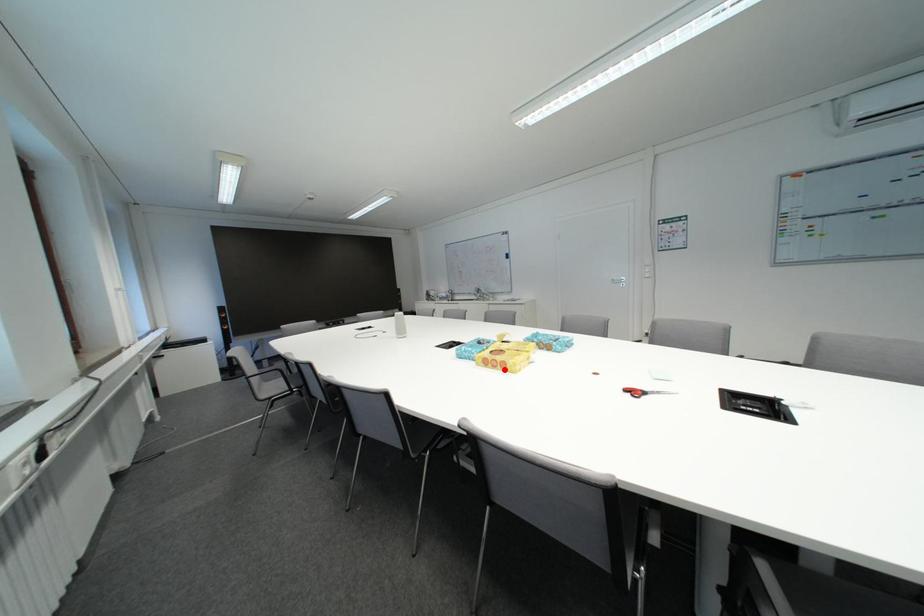
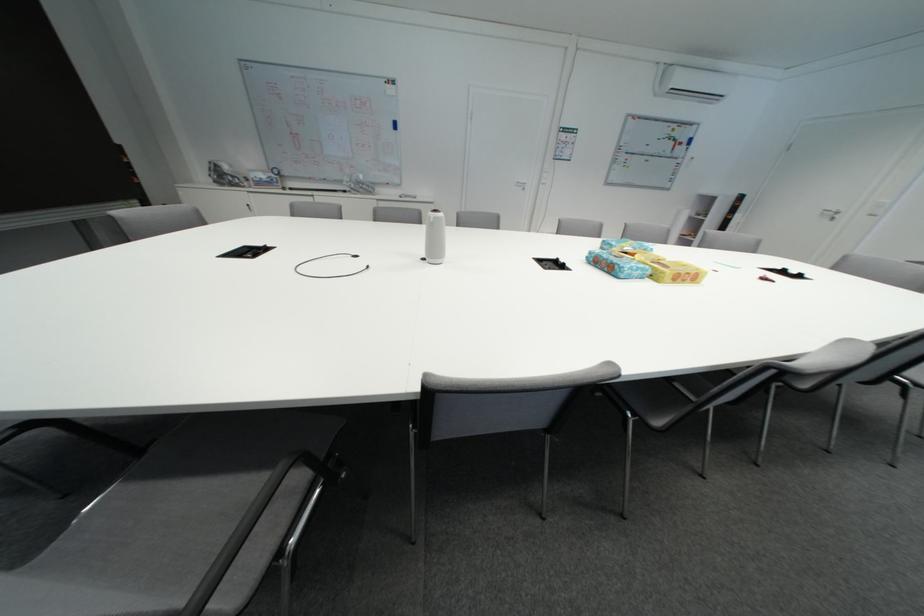
Find the pixel in the second image that matches the highlighted location in the first image.

(694, 283)